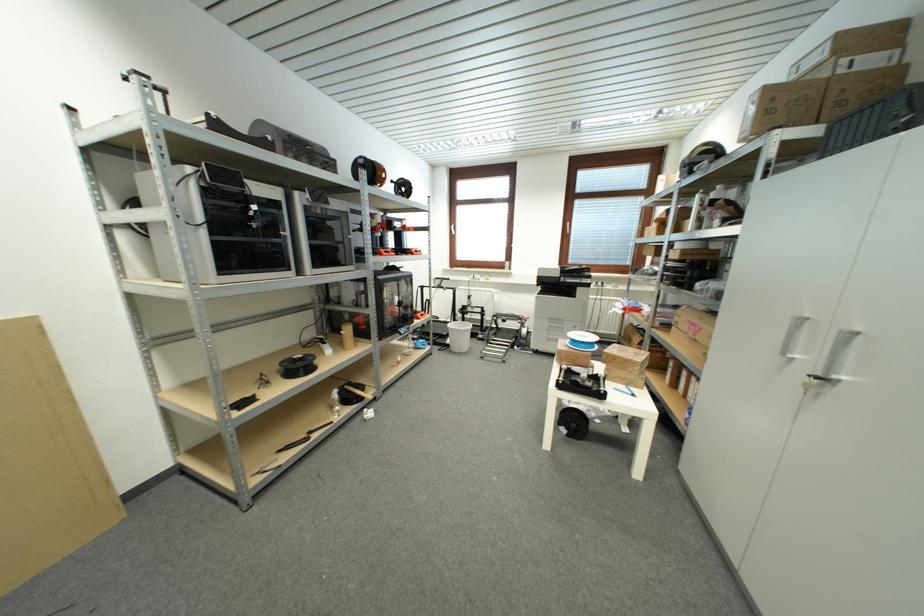
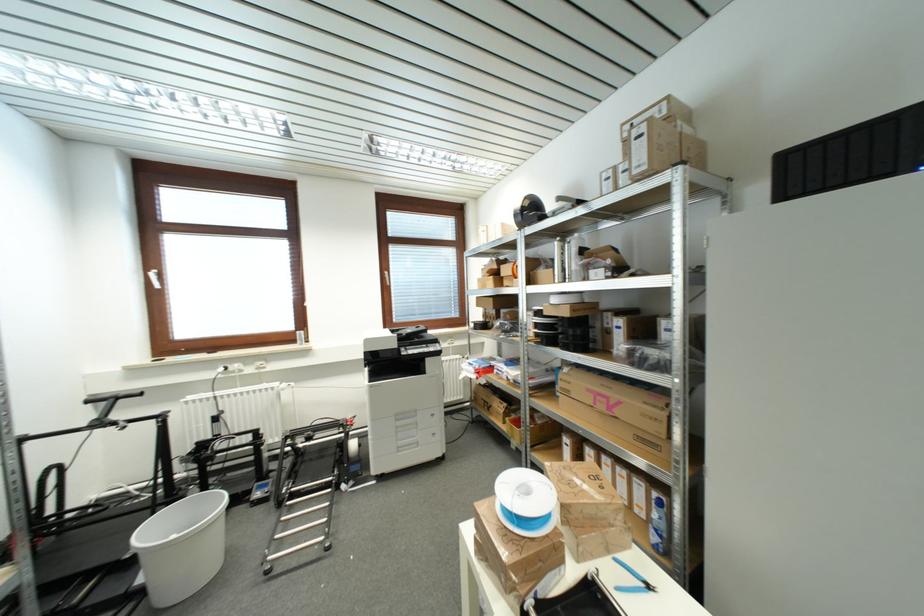
Find the pixel in the second image that matches the point at 502,318 in the first image.

(297, 438)